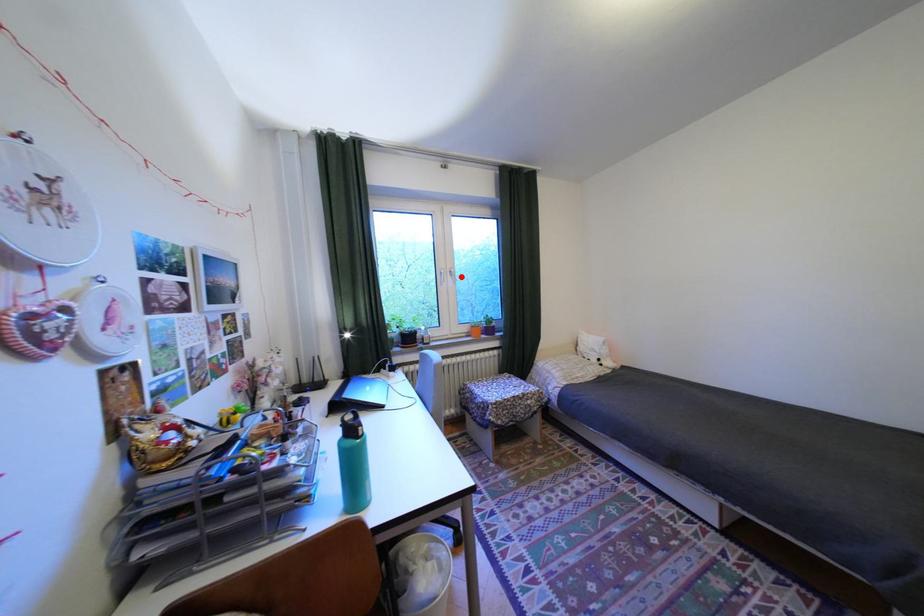
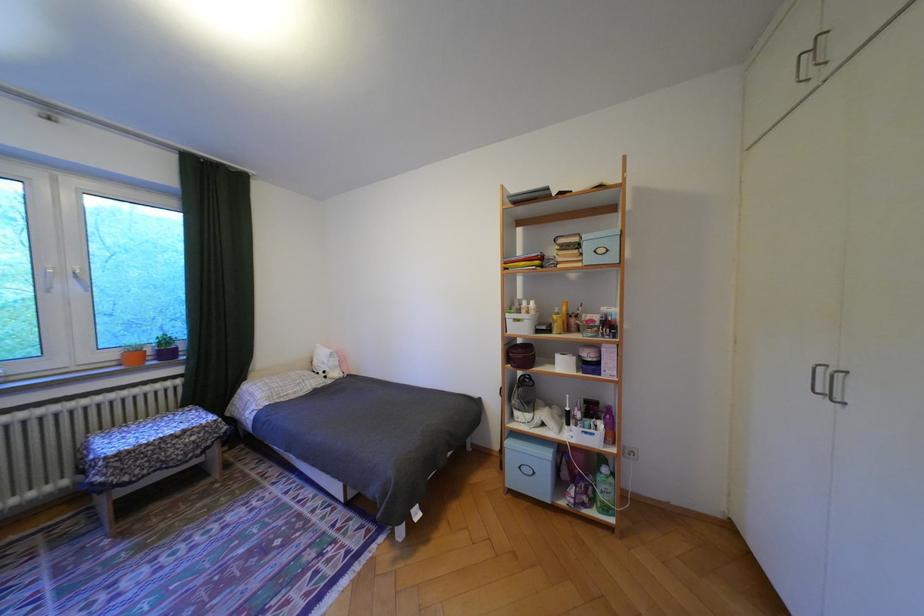
Question: I am providing you with two images of the same scene from different viewpoints. In image1, a red point is highlighted. Considering the same 3D point in image2, which of the following is correct?

Choices:
 (A) It is closer
 (B) It is farther

Answer: (B)